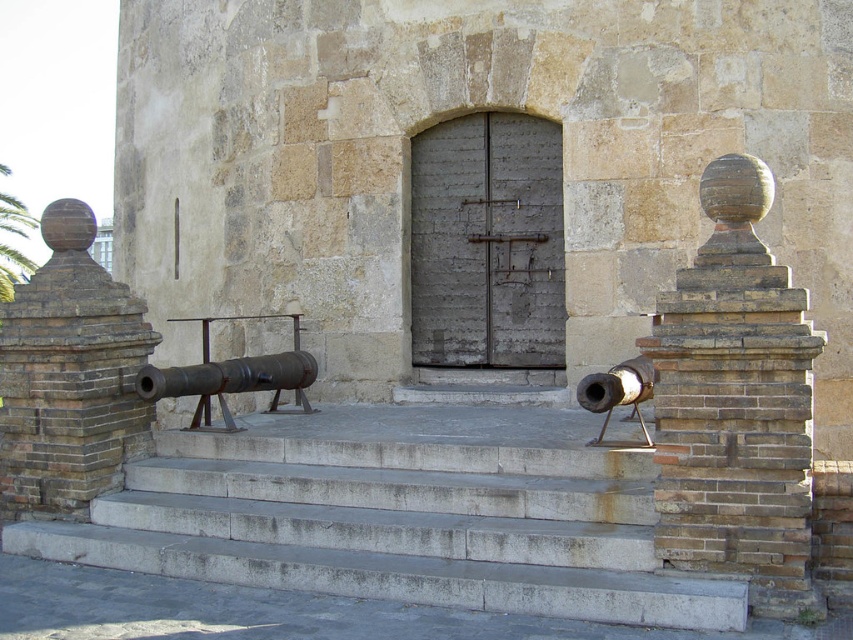
Question: Does gray concrete stairs at center come in front of brick textured pillar at right?

Choices:
 (A) yes
 (B) no

Answer: (A)

Question: Which object is closer to the camera taking this photo?

Choices:
 (A) gray concrete stairs at center
 (B) brick textured pillar at right
 (C) rusty metal cannon at right

Answer: (A)

Question: Which of these objects is positioned closest to the rusty metal cannon at right?

Choices:
 (A) rusty metal cannon at center
 (B) brick textured pillar at right
 (C) gray concrete stairs at center

Answer: (B)

Question: Among these objects, which one is nearest to the camera?

Choices:
 (A) rusty metal cannon at right
 (B) brown brick pillar at left

Answer: (A)

Question: Where is rusty metal cannon at center located in relation to rusty metal cannon at right in the image?

Choices:
 (A) left
 (B) right

Answer: (A)

Question: Does brick textured pillar at right appear on the left side of brown brick pillar at left?

Choices:
 (A) no
 (B) yes

Answer: (A)